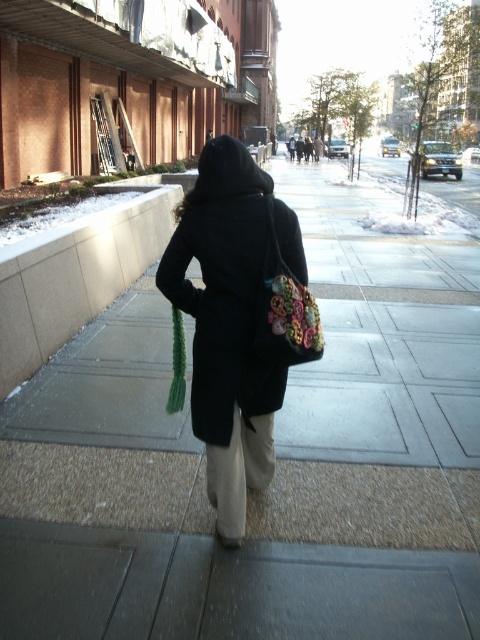
Between black matte coat at center and floral fabric bag at back, which one appears on the right side from the viewer's perspective?

floral fabric bag at back

Does black matte coat at center have a greater height compared to floral fabric bag at back?

Yes.

Find the location of `black matte coat at center`. black matte coat at center is located at coordinates (229, 321).